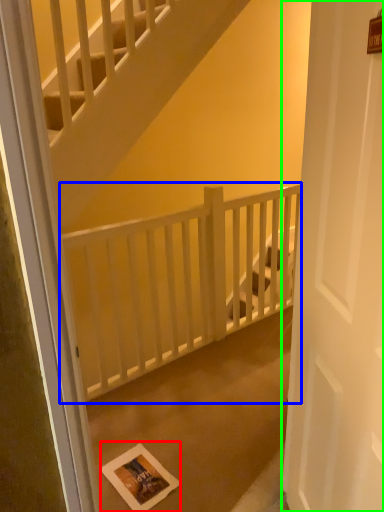
Question: Considering the real-world distances, which object is closest to postcard (highlighted by a red box)? balustrade (highlighted by a blue box) or door (highlighted by a green box).

Choices:
 (A) balustrade
 (B) door

Answer: (A)